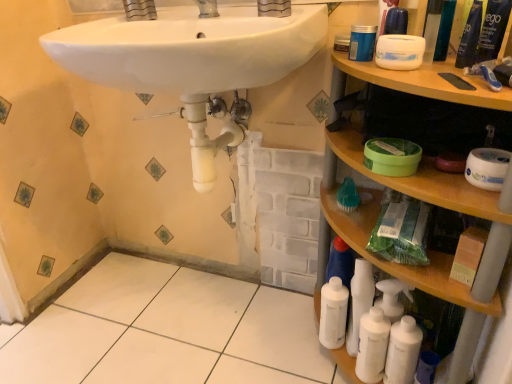
Locate an element on the screen. Image resolution: width=512 pixels, height=384 pixels. blank area to the left of white glossy tap at upper center is located at coordinates (144, 21).